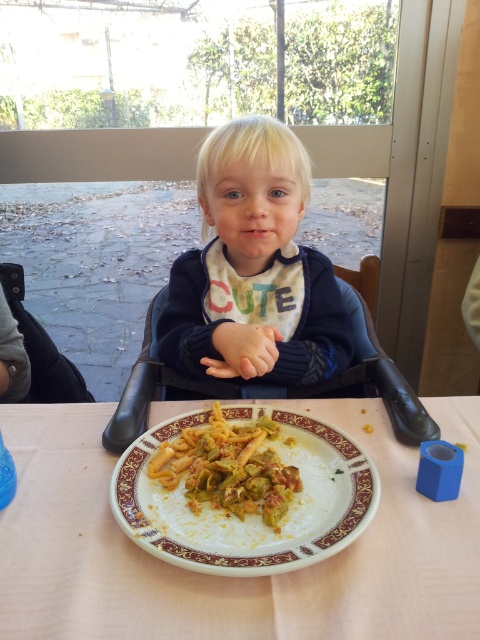
Consider the image. You are a photographer setting up for a family photo. The child is wearing the cute sweater at center and has the white glossy plate at lower center in front of them. To ensure the sweater is visible in the shot, should you position the light source to the left or right of the plate?

The cute sweater at center is to the left of the white glossy plate at lower center. Positioning the light source to the right of the plate would cast shadows away from the sweater, making it more visible.

You are a photographer standing at a certain distance from the child in the high chair. You want to take a closeup shot of the cute sweater at center without moving the camera. Is the current distance sufficient to capture the sweater in focus?

The distance between the cute sweater at center and the camera is 64.73 centimeters. Since the photographer is already at this distance, the current position allows the sweater to be in focus for a closeup shot.

You are a photographer standing in front of the child in the high chair. You need to adjust the lighting so that both the white ceramic plate at center and the cute sweater at center are well lit. Since the plate is closer to you than the sweater, will you need to move the light source closer or farther away to ensure both are properly illuminated?

The white ceramic plate at center is 24.20 centimeters from the cute sweater at center, meaning the plate is closer to you than the sweater. To ensure both are properly illuminated, you should move the light source slightly closer to the sweater so that the farther object receives enough light, while the closer plate remains adequately lit.